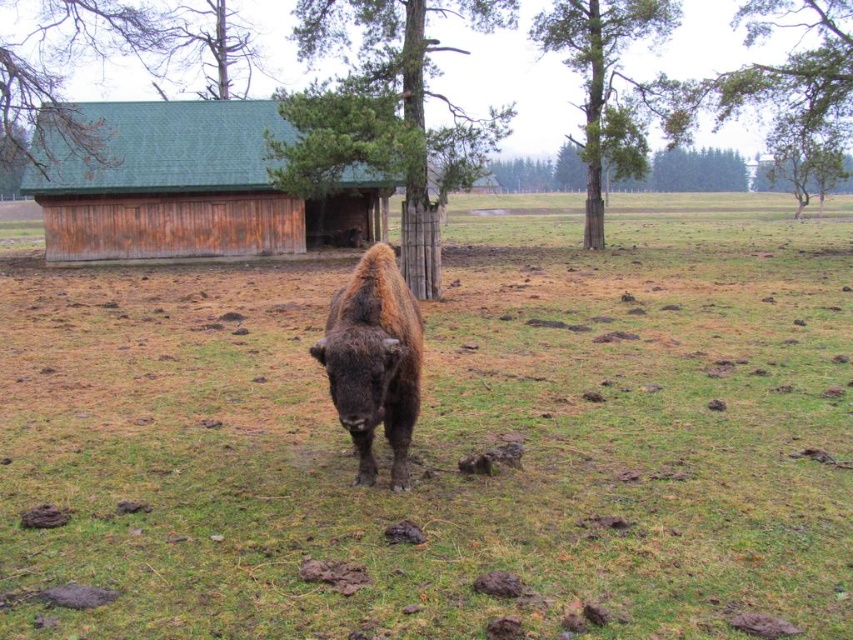
Question: Which point is farther to the camera?

Choices:
 (A) green wood tree at center
 (B) green shingled roof at upper left
 (C) green rough bark tree at upper center

Answer: (C)

Question: Can you confirm if green grassy field at center is bigger than green leafy tree at upper right?

Choices:
 (A) yes
 (B) no

Answer: (B)

Question: Is green grassy field at center to the right of brown fuzzy yak at center from the viewer's perspective?

Choices:
 (A) no
 (B) yes

Answer: (B)

Question: Which of the following is the farthest from the observer?

Choices:
 (A) (589, 84)
 (B) (846, 74)
 (C) (579, 602)

Answer: (A)

Question: Which object appears closest to the camera in this image?

Choices:
 (A) brown fuzzy yak at center
 (B) green grassy field at center
 (C) green shingled roof at upper left

Answer: (B)

Question: Can you confirm if green shingled roof at upper left is positioned above green rough bark tree at upper center?

Choices:
 (A) no
 (B) yes

Answer: (A)